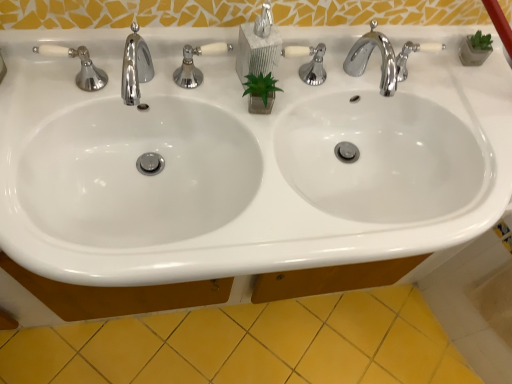
You are a GUI agent. You are given a task and a screenshot of the screen. Output one action in this format:
    pyautogui.click(x=<x>, y=<y>)
    Task: Click on the vacant space to the right of polished chrome faucet at upper right, arranged as the first tap when viewed from the right
    Image resolution: width=512 pixels, height=384 pixels.
    Given the screenshot: What is the action you would take?
    pyautogui.click(x=443, y=102)